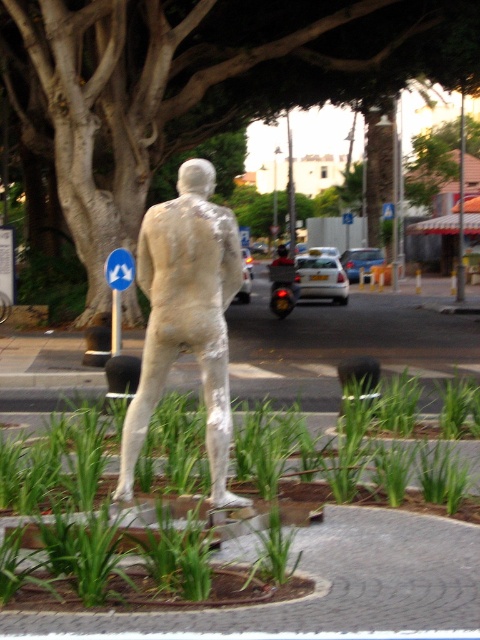
You are a city planner analyzing the urban street scene. You need to place a new streetlight pole exactly at the center of the garden bed. The garden bed is bordered by the black bollards. Where should you place the pole relative to the green leafy tree at upper center?

The green leafy tree at upper center is located at coordinates (x=204, y=83). The garden bed is bordered by black bollards, so the center of the garden bed would be the midpoint between the bollards. To determine the pole placement relative to the tree, calculate the distance between the tree and the garden bed center using the coordinates provided.

You are a city planner assessing the space between the white plaster figure at center and the blue plastic sign at upper left. Which object has a narrower width?

The white plaster figure at center is thinner than the blue plastic sign at upper left, so the white plaster figure at center has a narrower width.

Consider the image. You are a city planner trying to install a new bench in this urban street scene. The bench will be placed exactly halfway between the statue of a human figure and the green leafy tree at upper center. How far will the bench be from the statue of a human figure?

The bench will be placed exactly halfway between the statue of a human figure and the green leafy tree at upper center, so the distance from the statue to the bench will be half of 56.53 feet, which is approximately 28.26 feet.